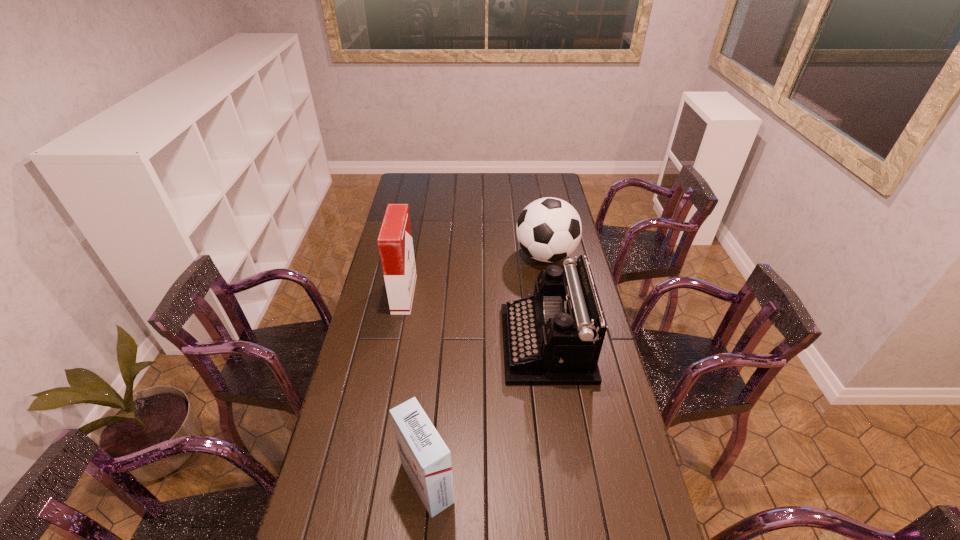
The width and height of the screenshot is (960, 540). In order to click on vacant space situated 0.090m on the back of the soccer ball in this screenshot , I will do `click(540, 226)`.

Locate an element on the screen. This screenshot has width=960, height=540. vacant region located on the right of the shorter cigarette case is located at coordinates (561, 482).

Image resolution: width=960 pixels, height=540 pixels. I want to click on object positioned at the left edge, so click(395, 243).

Identify the location of typewriter that is at the right edge. This screenshot has width=960, height=540. (555, 337).

Locate an element on the screen. Image resolution: width=960 pixels, height=540 pixels. soccer ball that is at the right edge is located at coordinates (549, 229).

Where is `vacant space at the far edge of the desktop`? This screenshot has height=540, width=960. vacant space at the far edge of the desktop is located at coordinates (463, 174).

The height and width of the screenshot is (540, 960). In the image, there is a desktop. Identify the location of free space at the left edge. (375, 416).

What are the coordinates of `free space at the right edge of the desktop` in the screenshot? It's located at (596, 464).

The image size is (960, 540). What are the coordinates of `free space at the far left corner` in the screenshot? It's located at (403, 188).

Find the location of `free area in between the right cigarette case and the typewriter`. free area in between the right cigarette case and the typewriter is located at coordinates (487, 413).